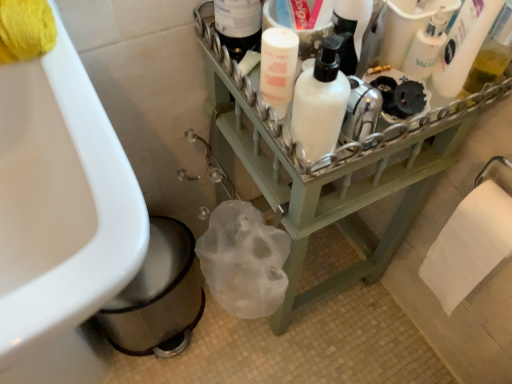
Question: Does white paper towel at lower right, the second toilet paper in the top-to-bottom sequence, have a larger size compared to green wood shelf at center?

Choices:
 (A) no
 (B) yes

Answer: (A)

Question: Are white paper towel at lower right, placed as the 1th toilet paper when sorted from right to left, and green wood shelf at center far apart?

Choices:
 (A) no
 (B) yes

Answer: (A)

Question: Considering the relative sizes of white paper towel at lower right, the second toilet paper in the top-to-bottom sequence, and green wood shelf at center in the image provided, is white paper towel at lower right, the second toilet paper in the top-to-bottom sequence, thinner than green wood shelf at center?

Choices:
 (A) yes
 (B) no

Answer: (A)

Question: Could green wood shelf at center be considered to be inside white paper towel at lower right, which is counted as the 1th toilet paper, starting from the back?

Choices:
 (A) yes
 (B) no

Answer: (B)

Question: Considering the relative sizes of white paper towel at lower right, the second toilet paper in the top-to-bottom sequence, and green wood shelf at center in the image provided, is white paper towel at lower right, the second toilet paper in the top-to-bottom sequence, wider than green wood shelf at center?

Choices:
 (A) yes
 (B) no

Answer: (B)

Question: From a real-world perspective, relative to translucent plastic bottle at upper right, the 1th cleaning product when ordered from right to left, is white matte bottle at upper right, the second cleaning product from the right, vertically above or below?

Choices:
 (A) above
 (B) below

Answer: (B)

Question: Visually, is white matte bottle at upper right, the second cleaning product from the right, positioned to the left or to the right of translucent plastic bottle at upper right, the 1th cleaning product when ordered from right to left?

Choices:
 (A) right
 (B) left

Answer: (B)

Question: From the image's perspective, relative to translucent plastic bottle at upper right, the fourth cleaning product when ordered from left to right, is white matte bottle at upper right, which appears as the 3th cleaning product when viewed from the left, above or below?

Choices:
 (A) below
 (B) above

Answer: (A)

Question: Is white matte bottle at upper right, the second cleaning product from the right, wider or thinner than translucent plastic bottle at upper right, the fourth cleaning product when ordered from left to right?

Choices:
 (A) wide
 (B) thin

Answer: (A)

Question: From a real-world perspective, is translucent plastic bottle at upper right, the 1th cleaning product when ordered from right to left, positioned above or below white matte bottle at upper right, which appears as the 3th cleaning product when viewed from the left?

Choices:
 (A) below
 (B) above

Answer: (B)

Question: Is translucent plastic bottle at upper right, the fourth cleaning product when ordered from left to right, spatially inside white matte bottle at upper right, the second cleaning product from the right, or outside of it?

Choices:
 (A) inside
 (B) outside

Answer: (B)

Question: From the image's perspective, relative to white matte bottle at upper right, which appears as the 3th cleaning product when viewed from the left, is translucent plastic bottle at upper right, the 1th cleaning product when ordered from right to left, above or below?

Choices:
 (A) above
 (B) below

Answer: (A)

Question: In the image, is translucent plastic bottle at upper right, the fourth cleaning product when ordered from left to right, positioned in front of or behind white matte bottle at upper right, the second cleaning product from the right?

Choices:
 (A) behind
 (B) front

Answer: (B)

Question: In terms of width, does white matte pump bottle at upper center, the 4th cleaning product when ordered from right to left, look wider or thinner when compared to white glossy sink at lower left?

Choices:
 (A) thin
 (B) wide

Answer: (A)

Question: Looking at the image, does white matte pump bottle at upper center, which is the 1th cleaning product in left-to-right order, seem bigger or smaller compared to white glossy sink at lower left?

Choices:
 (A) small
 (B) big

Answer: (A)